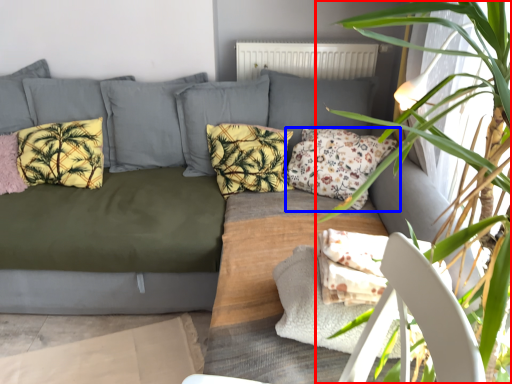
Question: Which of the following is the closest to the observer, houseplant (highlighted by a red box) or pillow (highlighted by a blue box)?

Choices:
 (A) houseplant
 (B) pillow

Answer: (A)